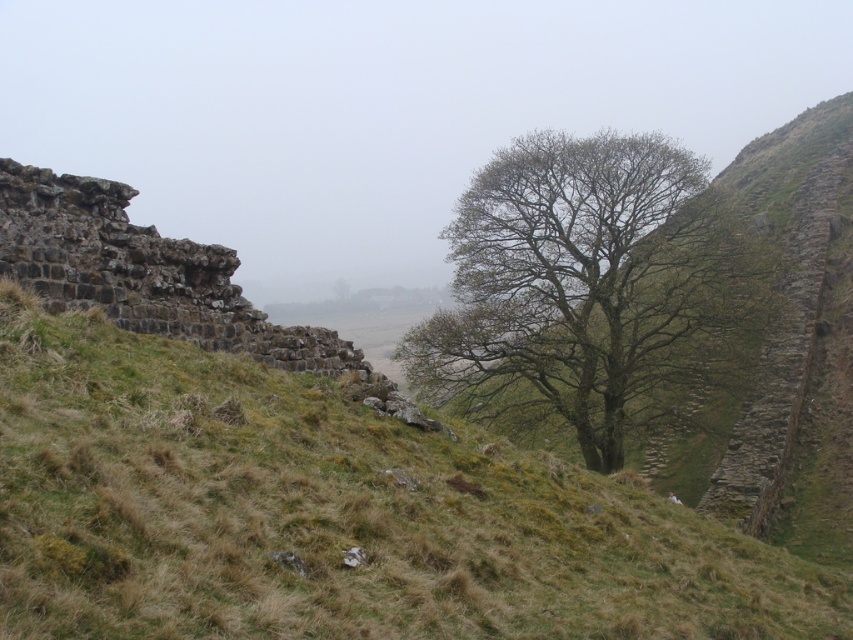
You are standing in the misty landscape and want to walk towards the green leafy tree at center. Which direction should you go from the green grassy at center to reach it?

The green grassy at center is to the left of the green leafy tree at center, so you should go to the right to reach the tree.

You are a hiker who wants to take a photo of the ancient stone ruins to the left and the green leafy tree at center in the same frame. The camera you have can capture a maximum distance of 50 meters between objects. Will you be able to capture both in one shot?

The distance between the ancient stone ruins to the left and the green leafy tree at center is 49.84 meters, which is just under the camera maximum distance of 50 meters. Yes, you can capture both in one shot.

You are planning to set up a small tent in this misty landscape. Given the scene, which area between the green grassy at center and the rustic stone cliff at left would provide a wider space for the tent?

The green grassy at center has a larger width than the rustic stone cliff at left, so it would provide a wider space for setting up the tent.